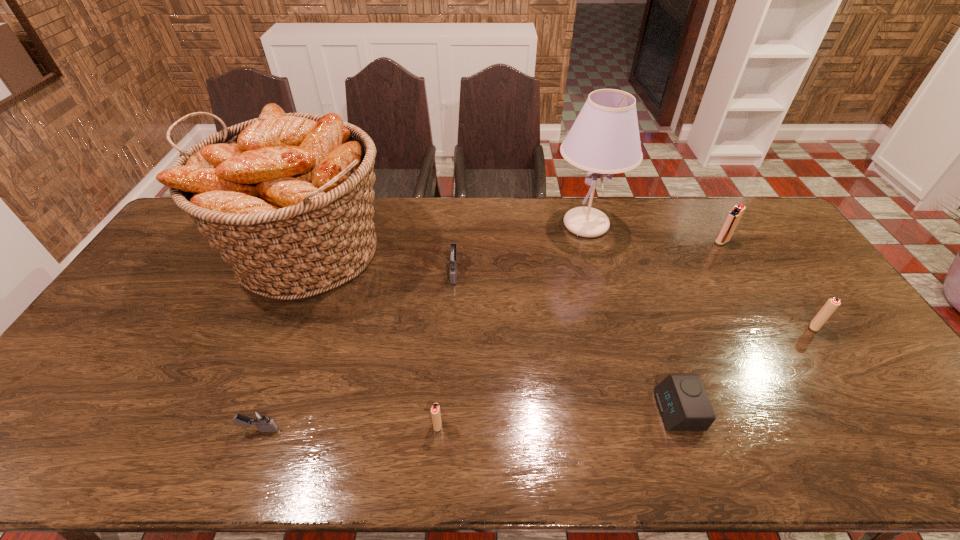
Image resolution: width=960 pixels, height=540 pixels. I want to click on lampshade, so click(x=604, y=139).

The width and height of the screenshot is (960, 540). I want to click on basket, so tap(286, 199).

Locate an element on the screen. The width and height of the screenshot is (960, 540). the second object from right to left is located at coordinates (733, 217).

I want to click on the farthest red igniter, so coord(733,217).

In order to click on the fourth nearest igniter in this screenshot , I will do `click(452, 257)`.

The image size is (960, 540). I want to click on the farther gray igniter, so click(x=452, y=257).

Identify the location of the second biggest red igniter. pos(832,304).

At what (x,y) coordinates should I click in order to perform the action: click on the rightmost red igniter. Please return your answer as a coordinate pair (x, y). Looking at the image, I should click on (832, 304).

Where is `the smallest red igniter`? The image size is (960, 540). the smallest red igniter is located at coordinates (435, 410).

Locate an element on the screen. The width and height of the screenshot is (960, 540). the leftmost red igniter is located at coordinates (435, 410).